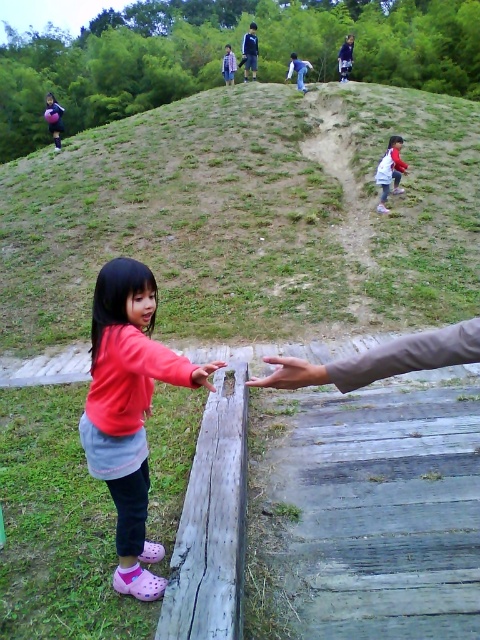
You are a photographer trying to capture a photo of both the matte pink hoodie at upper right and the pink fabric dress at lower left. Which object should you adjust your camera to focus on first if you want to ensure both are in the frame?

You should focus on the matte pink hoodie at upper right first because it is positioned on the right side of the pink fabric dress at lower left, so adjusting the camera to include the rightmost object ensures both are in frame.

You are standing at the point labeled as point (54, 100) and want to walk to the point labeled as point (218, 365). Which direction should you move relative to the other point?

Since point (54, 100) is behind point (218, 365), you should move forward towards point (218, 365) to reach it.

You are a photographer trying to capture a shot of the pink fabric dress at lower left and the smooth wooden hand at lower center. Since you want both subjects in focus, you need to know their distance apart. Can you tell me how far apart they are?

The pink fabric dress at lower left is to the left of smooth wooden hand at lower center, but the exact distance between them isn